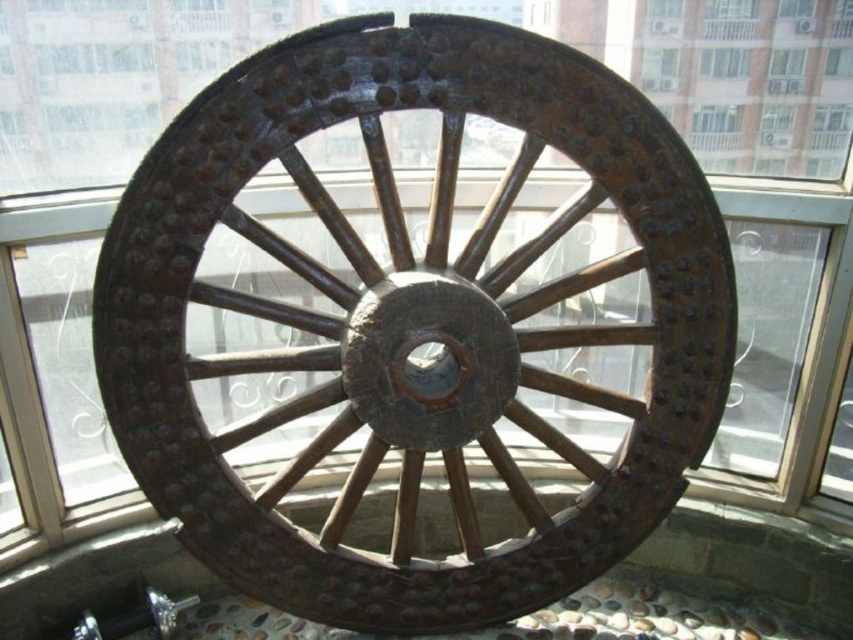
Can you confirm if rusty wood wagon wheel at center is thinner than clear glass window at upper center?

No, rusty wood wagon wheel at center is not thinner than clear glass window at upper center.

Which of these two, rusty wood wagon wheel at center or clear glass window at upper center, stands taller?

rusty wood wagon wheel at center is taller.

Find the location of a particular element. rusty wood wagon wheel at center is located at coordinates (383, 284).

At what (x,y) coordinates should I click in order to perform the action: click on rusty wood wagon wheel at center. Please return your answer as a coordinate pair (x, y). Looking at the image, I should click on click(x=383, y=284).